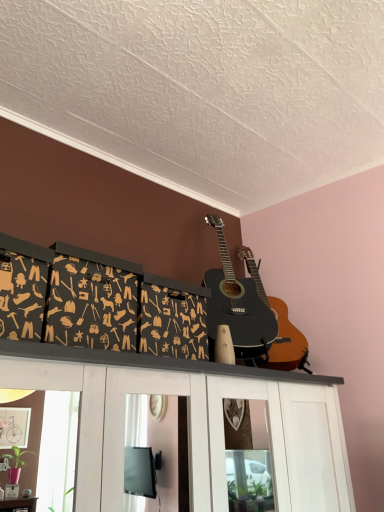
Where is `dark gray wood storage boxes at upper center`? The width and height of the screenshot is (384, 512). dark gray wood storage boxes at upper center is located at coordinates (98, 303).

Describe the element at coordinates (98, 303) in the screenshot. I see `dark gray wood storage boxes at upper center` at that location.

Locate an element on the screen. The image size is (384, 512). dark gray wood storage boxes at upper center is located at coordinates (98, 303).